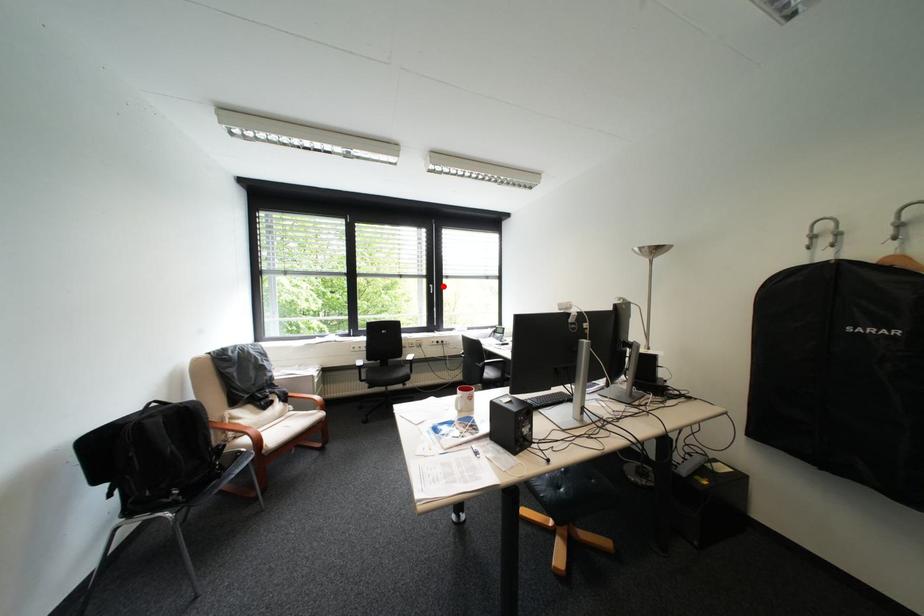
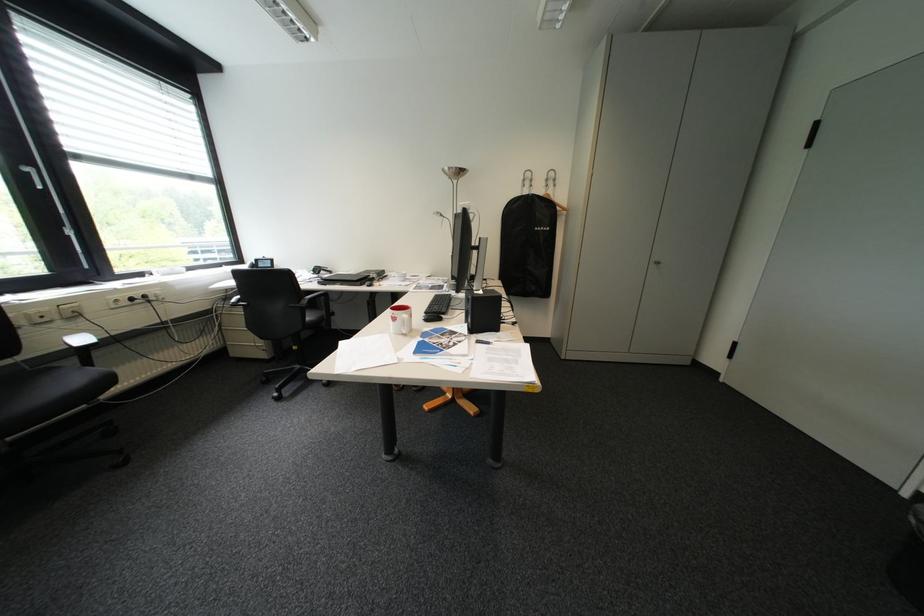
Question: I am providing you with two images of the same scene from different viewpoints. A red point is shown in image1. For the corresponding object point in image2, is it positioned nearer or farther from the camera?

Choices:
 (A) Nearer
 (B) Farther

Answer: (B)